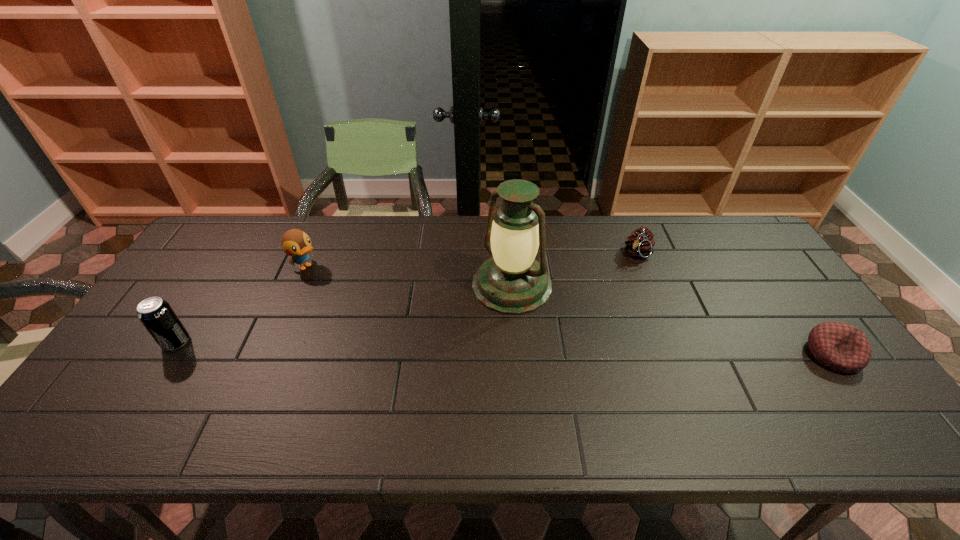
Identify the location of soda can. (157, 316).

Where is `beanbag`? The image size is (960, 540). beanbag is located at coordinates (839, 346).

Image resolution: width=960 pixels, height=540 pixels. What are the coordinates of `the rightmost object` in the screenshot? It's located at (839, 346).

You are a GUI agent. You are given a task and a screenshot of the screen. Output one action in this format:
    pyautogui.click(x=<x>, y=<y>)
    Task: Click on the fourth object from right to left
    
    Given the screenshot: What is the action you would take?
    pyautogui.click(x=295, y=243)

I want to click on the second object from right to left, so click(640, 243).

Locate an element on the screen. The height and width of the screenshot is (540, 960). pinecone is located at coordinates (640, 243).

Locate an element on the screen. This screenshot has width=960, height=540. the tallest object is located at coordinates (510, 282).

This screenshot has height=540, width=960. What are the coordinates of `the third object from left to right` in the screenshot? It's located at (510, 282).

Identify the location of vacant space situated 0.220m on the back of the soda can. This screenshot has width=960, height=540. (218, 277).

Locate an element on the screen. The height and width of the screenshot is (540, 960). blank area located 0.390m on the back of the rightmost object is located at coordinates (753, 243).